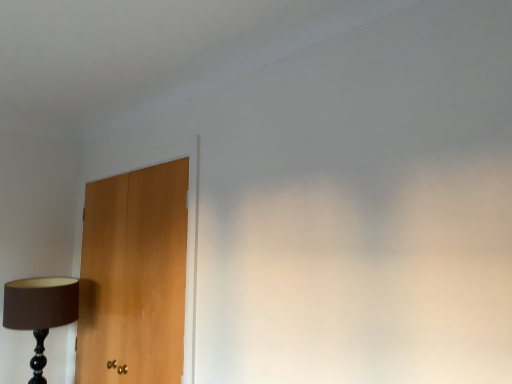
Question: Does light brown wood door at left have a lesser width compared to matte black lamp at left?

Choices:
 (A) no
 (B) yes

Answer: (B)

Question: Does light brown wood door at left have a greater height compared to matte black lamp at left?

Choices:
 (A) yes
 (B) no

Answer: (A)

Question: Is light brown wood door at left looking in the opposite direction of matte black lamp at left?

Choices:
 (A) yes
 (B) no

Answer: (A)

Question: Is light brown wood door at left wider than matte black lamp at left?

Choices:
 (A) yes
 (B) no

Answer: (B)

Question: Is light brown wood door at left bigger than matte black lamp at left?

Choices:
 (A) yes
 (B) no

Answer: (A)

Question: From the image's perspective, is light brown wood door at left located above matte black lamp at left?

Choices:
 (A) no
 (B) yes

Answer: (B)

Question: Is the surface of matte black lamp at left in direct contact with light brown wood door at left?

Choices:
 (A) yes
 (B) no

Answer: (B)

Question: From a real-world perspective, is matte black lamp at left over light brown wood door at left?

Choices:
 (A) no
 (B) yes

Answer: (A)

Question: Can you confirm if matte black lamp at left is taller than light brown wood door at left?

Choices:
 (A) no
 (B) yes

Answer: (A)

Question: Is matte black lamp at left oriented away from light brown wood door at left?

Choices:
 (A) no
 (B) yes

Answer: (A)

Question: Is matte black lamp at left outside light brown wood door at left?

Choices:
 (A) no
 (B) yes

Answer: (B)

Question: Considering the relative sizes of matte black lamp at left and light brown wood door at left in the image provided, is matte black lamp at left shorter than light brown wood door at left?

Choices:
 (A) no
 (B) yes

Answer: (B)

Question: In terms of size, does matte black lamp at left appear bigger or smaller than light brown wood door at left?

Choices:
 (A) small
 (B) big

Answer: (A)